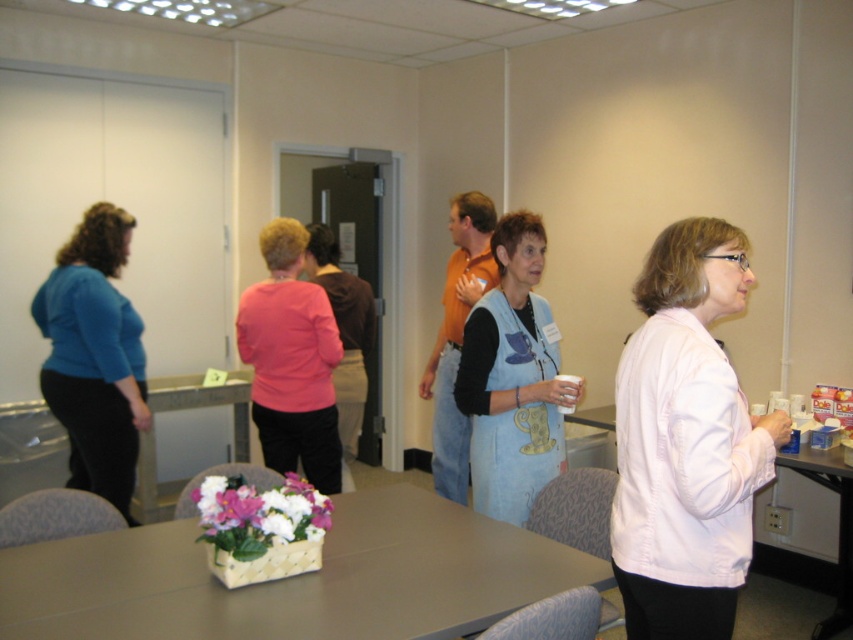
Which of these two, light blue denim vest at center or blue matte shirt at left, stands taller?

blue matte shirt at left

Based on the photo, who is higher up, light blue denim vest at center or blue matte shirt at left?

Positioned higher is light blue denim vest at center.

In order to click on light blue denim vest at center in this screenshot , I will do coord(514,378).

How far apart are smooth beige table at center and light blue denim vest at center?

22.75 inches

Does smooth beige table at center have a greater width compared to light blue denim vest at center?

Correct, the width of smooth beige table at center exceeds that of light blue denim vest at center.

Does point (86, 580) come behind point (463, 348)?

No, it is not.

Locate an element on the screen. smooth beige table at center is located at coordinates (294, 579).

Who is positioned more to the left, smooth beige table at center or pink matte sweater at center?

pink matte sweater at center

Who is lower down, smooth beige table at center or pink matte sweater at center?

smooth beige table at center

Locate an element on the screen. The image size is (853, 640). smooth beige table at center is located at coordinates (294, 579).

Image resolution: width=853 pixels, height=640 pixels. Find the location of `smooth beige table at center`. smooth beige table at center is located at coordinates (294, 579).